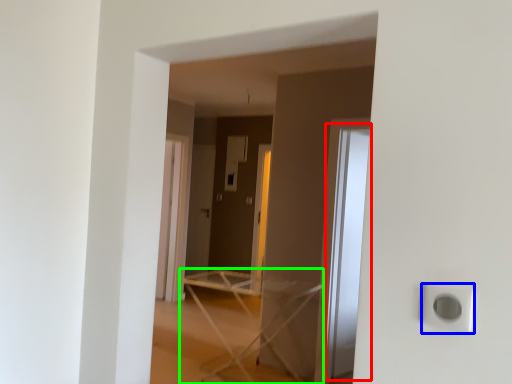
Question: Based on their relative distances, which object is farther from glass door (highlighted by a red box)? Choose from electric outlet (highlighted by a blue box) and furniture (highlighted by a green box).

Choices:
 (A) electric outlet
 (B) furniture

Answer: (A)